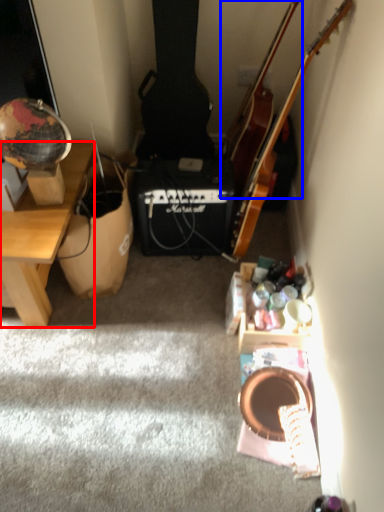
Question: Which object is closer to the camera taking this photo, desk (highlighted by a red box) or cello (highlighted by a blue box)?

Choices:
 (A) desk
 (B) cello

Answer: (A)